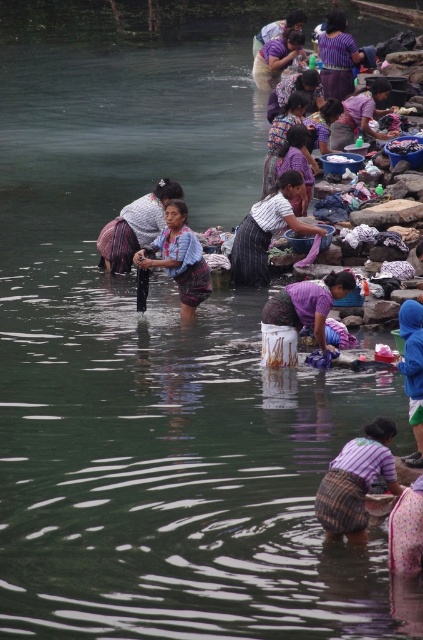
Does purple fabric at center appear under purple woven fabric at upper center?

Yes.

Which is below, purple fabric at center or purple woven fabric at upper center?

purple fabric at center is below.

Image resolution: width=423 pixels, height=640 pixels. What are the coordinates of `purple fabric at center` in the screenshot? It's located at (353, 120).

Is striped fabric skirt at center to the right of matte purple shirt at upper center from the viewer's perspective?

No, striped fabric skirt at center is not to the right of matte purple shirt at upper center.

Which of these two, striped fabric skirt at center or matte purple shirt at upper center, stands shorter?

Standing shorter between the two is matte purple shirt at upper center.

Where is `striped fabric skirt at center`? striped fabric skirt at center is located at coordinates pyautogui.click(x=258, y=240).

Find the location of a particular element. blue woven skirt at center is located at coordinates (184, 264).

Can you confirm if blue woven skirt at center is taller than matte purple shirt at upper center?

No.

Is point (184, 285) less distant than point (283, 48)?

That is True.

Locate an element on the screen. The height and width of the screenshot is (640, 423). blue woven skirt at center is located at coordinates (184, 264).